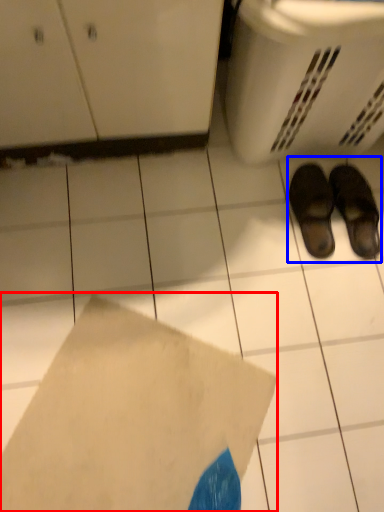
Question: Which point is closer to the camera, envelope (highlighted by a red box) or footwear (highlighted by a blue box)?

Choices:
 (A) envelope
 (B) footwear

Answer: (A)